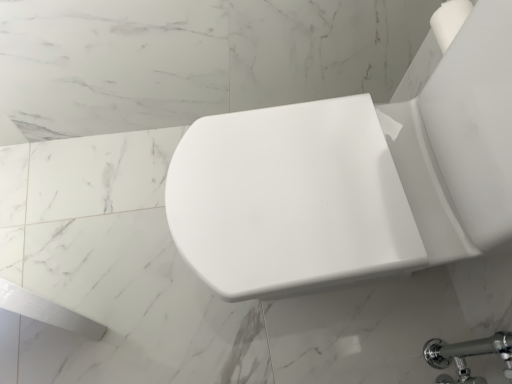
Image resolution: width=512 pixels, height=384 pixels. What are the coordinates of `white glossy toilet seat at center` in the screenshot? It's located at (352, 178).

The width and height of the screenshot is (512, 384). What do you see at coordinates (352, 178) in the screenshot? I see `white glossy toilet seat at center` at bounding box center [352, 178].

Measure the distance between white glossy toilet seat at center and camera.

They are 22.80 inches apart.

This screenshot has height=384, width=512. What are the coordinates of `white glossy toilet seat at center` in the screenshot? It's located at (352, 178).